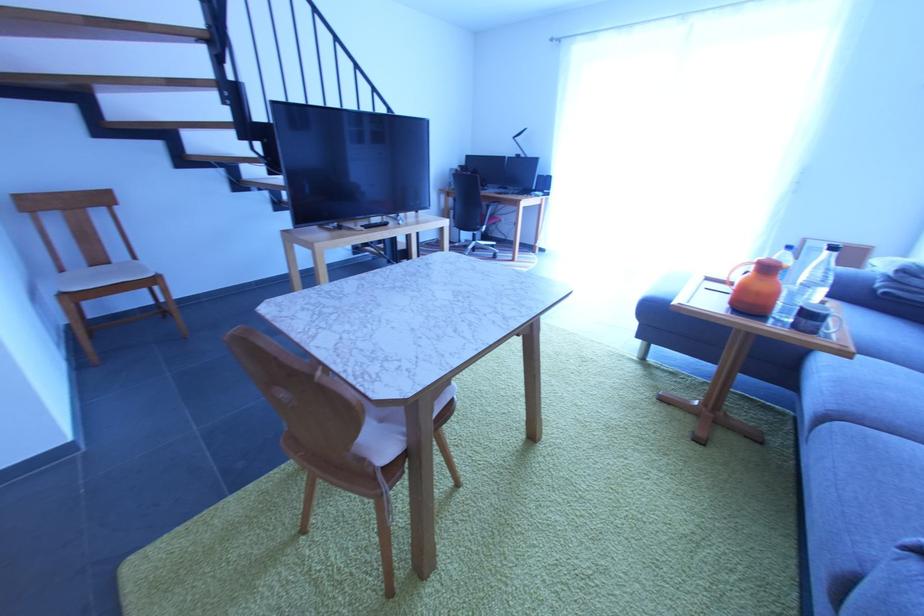
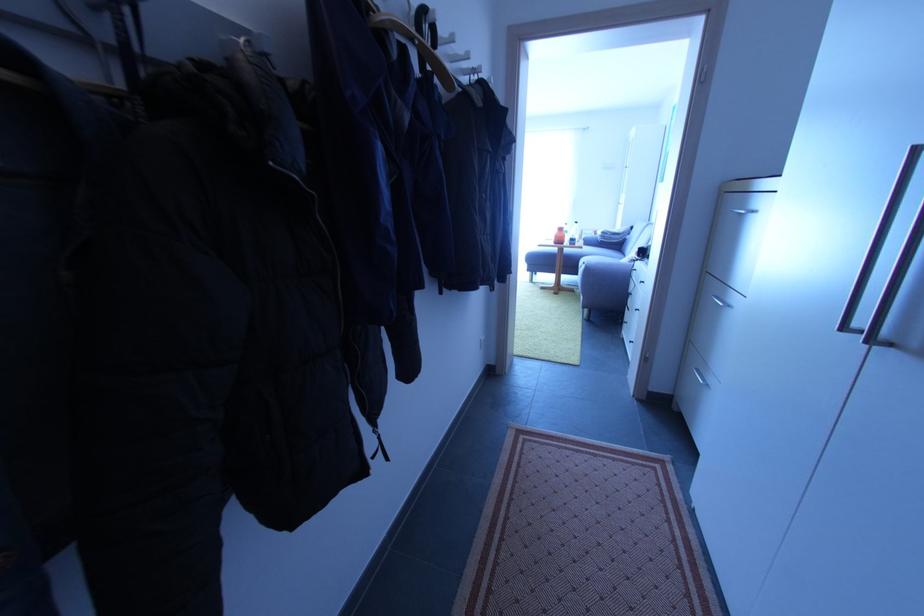
Locate, in the second image, the point that corresponds to (x=833, y=419) in the first image.

(586, 268)